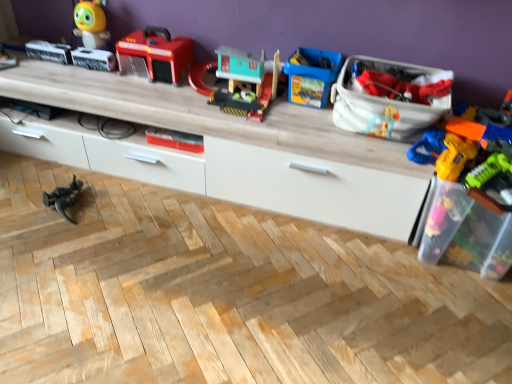
You are a GUI agent. You are given a task and a screenshot of the screen. Output one action in this format:
    pyautogui.click(x=<x>, y=<y>)
    Task: Click on the free point in front of shiny plastic toy at upper left, which is the 6th toy in right-to-left order
    
    Given the screenshot: What is the action you would take?
    (x=78, y=74)